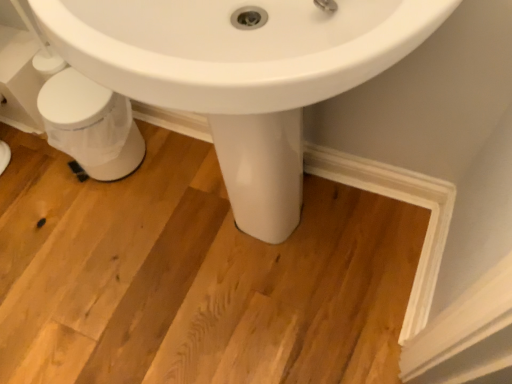
I want to click on vacant space positioned to the left of white plastic trash can at lower left, so click(38, 179).